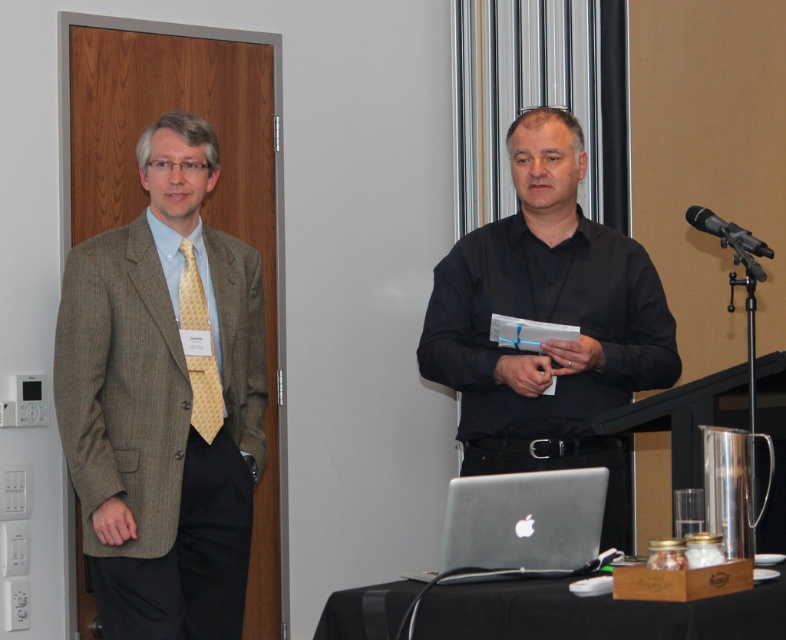
Question: Does black matte shirt at center appear under black fabric table at lower center?

Choices:
 (A) yes
 (B) no

Answer: (B)

Question: Is black fabric table at lower center positioned in front of black metallic microphone at upper right?

Choices:
 (A) no
 (B) yes

Answer: (B)

Question: Is yellowgeometric patterned fabrictie at left positioned before black metallic microphone at upper right?

Choices:
 (A) no
 (B) yes

Answer: (A)

Question: Considering the real-world distances, which object is closest to the black fabric table at lower center?

Choices:
 (A) sleek silver laptop at center
 (B) yellowgeometric patterned fabrictie at left
 (C) brown textured suit at left
 (D) black matte shirt at center

Answer: (A)

Question: Among these points, which one is farthest from the camera?

Choices:
 (A) [195, 355]
 (B) [182, 518]
 (C) [511, 310]

Answer: (C)

Question: Which point is closer to the camera taking this photo?

Choices:
 (A) click(634, 628)
 (B) click(559, 364)
 (C) click(739, 234)

Answer: (A)